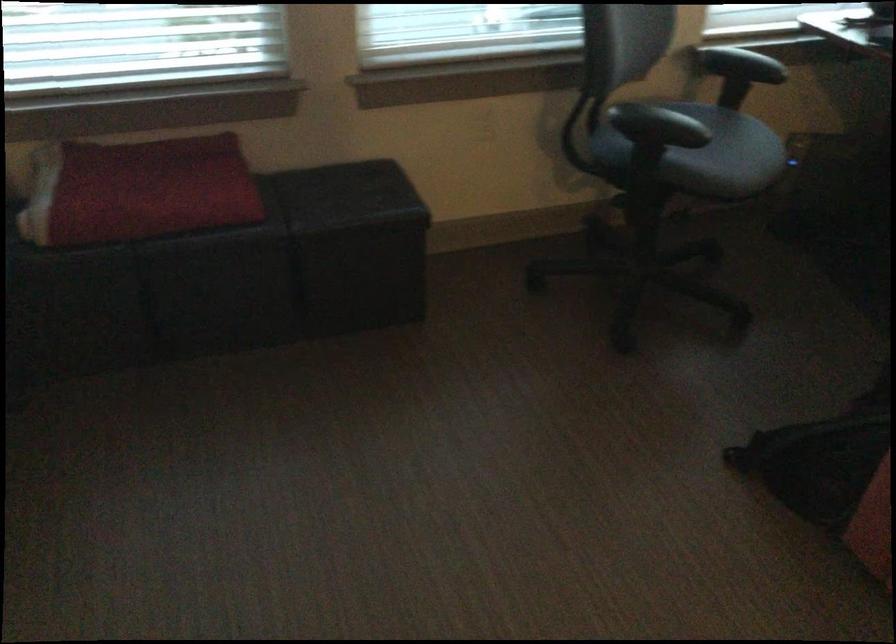
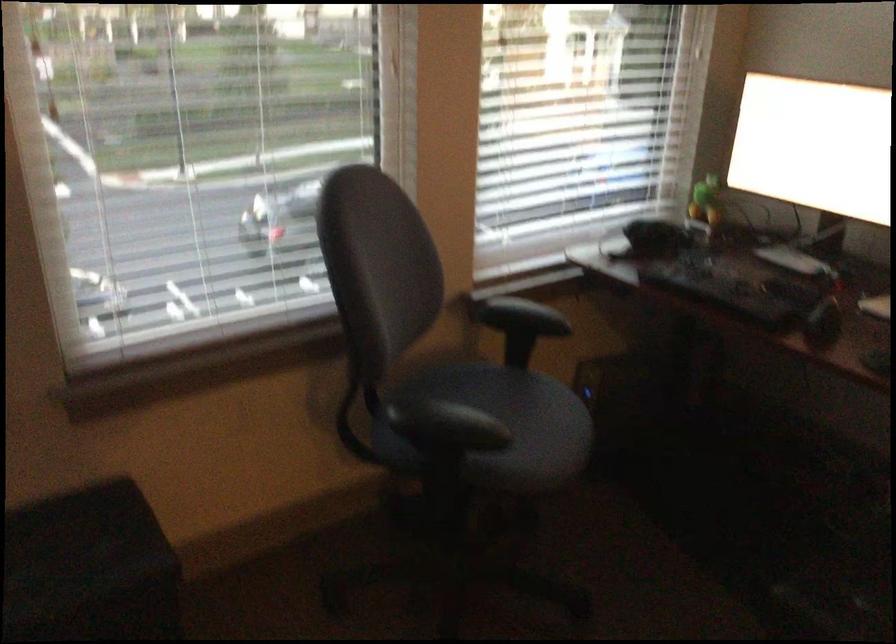
Question: The camera is either moving clockwise (left) or counter-clockwise (right) around the object. The first image is from the beginning of the video and the second image is from the end. Is the camera moving left or right when shooting the video?

Choices:
 (A) Left
 (B) Right

Answer: (A)